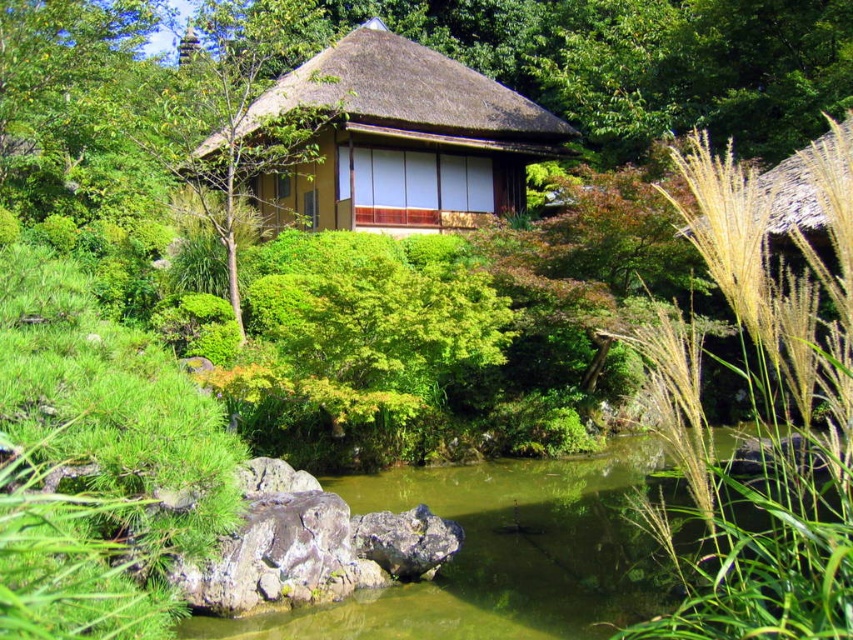
Question: Can you confirm if golden grass at right is positioned below matte brown thatched hut at center?

Choices:
 (A) yes
 (B) no

Answer: (A)

Question: Which object appears farthest from the camera in this image?

Choices:
 (A) matte brown thatched hut at center
 (B) golden grass at right

Answer: (A)

Question: Which point is farther to the camera?

Choices:
 (A) (276, 209)
 (B) (776, 547)

Answer: (A)

Question: Among these objects, which one is nearest to the camera?

Choices:
 (A) matte brown thatched hut at center
 (B) golden grass at right

Answer: (B)

Question: Can you confirm if golden grass at right is thinner than matte brown thatched hut at center?

Choices:
 (A) no
 (B) yes

Answer: (B)

Question: Is golden grass at right in front of matte brown thatched hut at center?

Choices:
 (A) yes
 (B) no

Answer: (A)